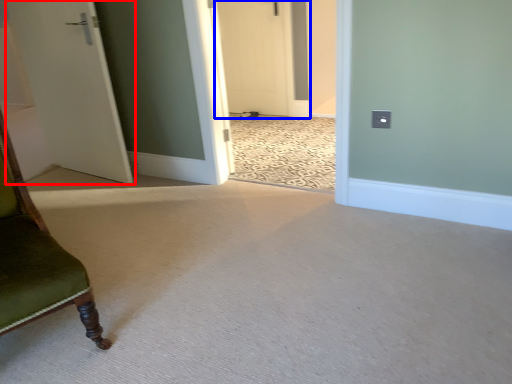
Question: Among these objects, which one is nearest to the camera, door (highlighted by a red box) or door (highlighted by a blue box)?

Choices:
 (A) door
 (B) door

Answer: (A)